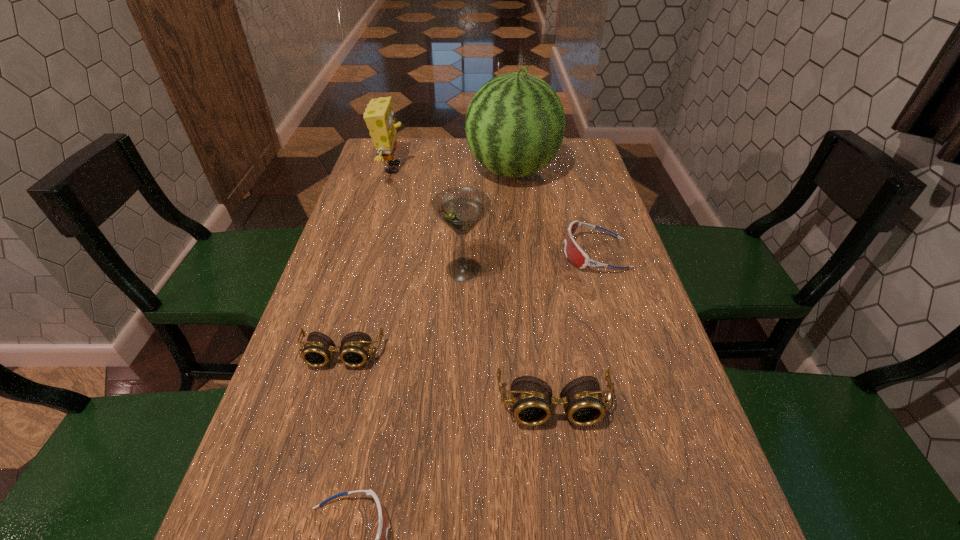
At what (x,y) coordinates should I click in order to perform the action: click on sponge that is at the left edge. Please return your answer as a coordinate pair (x, y). The width and height of the screenshot is (960, 540). Looking at the image, I should click on (379, 117).

Image resolution: width=960 pixels, height=540 pixels. Find the location of `goggles situated at the left edge`. goggles situated at the left edge is located at coordinates (355, 348).

Find the location of a particular element. This screenshot has height=540, width=960. watermelon that is at the right edge is located at coordinates (515, 124).

Where is `object that is at the far left corner`? object that is at the far left corner is located at coordinates (379, 117).

I want to click on object located in the far right corner section of the desktop, so click(515, 124).

The width and height of the screenshot is (960, 540). In the image, there is a desktop. Identify the location of vacant space at the left edge. (324, 315).

Where is `free space at the right edge of the desktop`? This screenshot has width=960, height=540. free space at the right edge of the desktop is located at coordinates (610, 300).

Where is `vacant region at the far right corner of the desktop`? The width and height of the screenshot is (960, 540). vacant region at the far right corner of the desktop is located at coordinates (594, 166).

Where is `empty space that is in between the sponge and the farther red goggles`? empty space that is in between the sponge and the farther red goggles is located at coordinates (493, 211).

Image resolution: width=960 pixels, height=540 pixels. Identify the location of vacant region between the right red goggles and the yellow sponge. (493, 211).